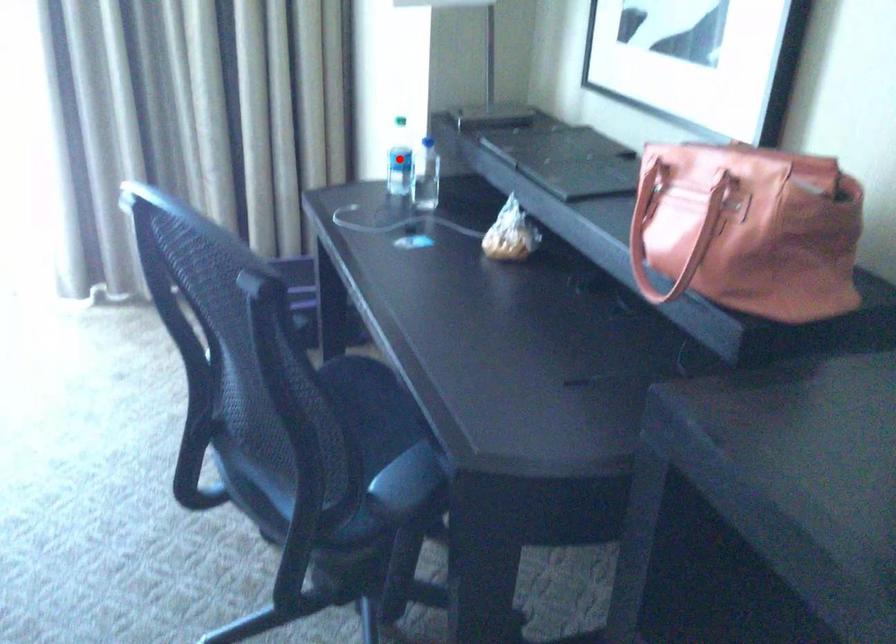
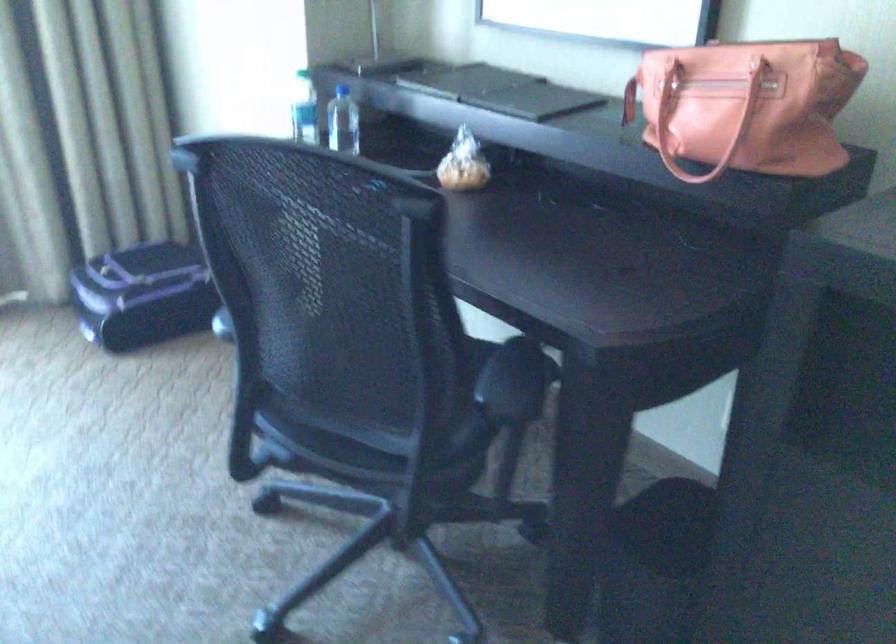
Find the pixel in the second image that matches the highlighted location in the first image.

(304, 109)